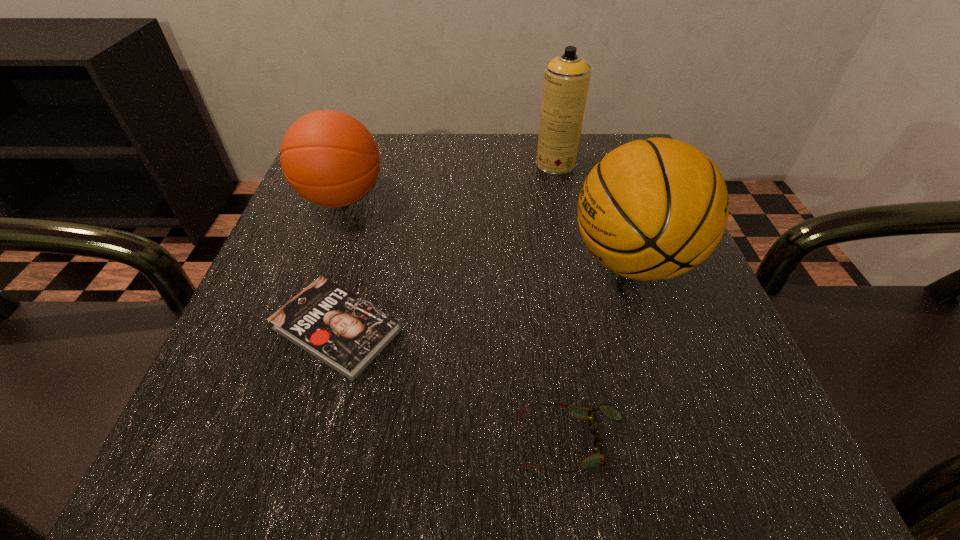
Locate an element on the screen. Image resolution: width=960 pixels, height=540 pixels. aerosol can is located at coordinates (566, 80).

Where is `the taller basketball`? This screenshot has height=540, width=960. the taller basketball is located at coordinates (651, 209).

Where is `the third shortest object`? The height and width of the screenshot is (540, 960). the third shortest object is located at coordinates point(329,158).

Where is `the shorter basketball`? The width and height of the screenshot is (960, 540). the shorter basketball is located at coordinates point(329,158).

The width and height of the screenshot is (960, 540). What are the coordinates of `the fourth tallest object` in the screenshot? It's located at (598, 459).

You are a GUI agent. You are given a task and a screenshot of the screen. Output one action in this format:
    pyautogui.click(x=<x>, y=<y>)
    Task: Click on the spectacles
    Image resolution: width=960 pixels, height=540 pixels.
    Given the screenshot: What is the action you would take?
    pyautogui.click(x=598, y=459)

Locate an element on the screen. The width and height of the screenshot is (960, 540). the shortest object is located at coordinates (341, 329).

Find the location of a particular element. This screenshot has width=960, height=540. free location located on the left of the aerosol can is located at coordinates (450, 164).

The height and width of the screenshot is (540, 960). In order to click on vacant space situated 0.100m on the surface of the right basketball near the brand logo in this screenshot , I will do coord(512,261).

I want to click on vacant space situated 0.380m on the surface of the right basketball near the brand logo, so click(x=349, y=261).